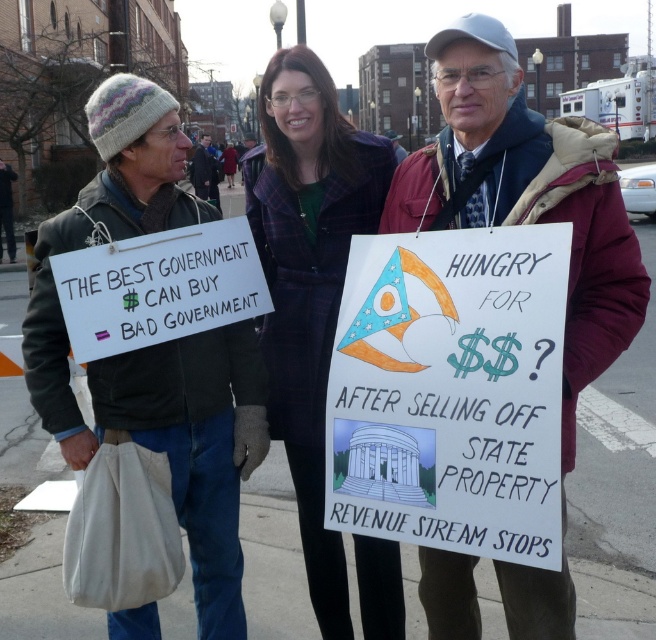
Does white paper sign at center have a larger size compared to plaid wool coat at center?

Actually, white paper sign at center might be smaller than plaid wool coat at center.

Who is more distant from viewer, (380, 529) or (350, 150)?

Point (350, 150)

Which is behind, point (543, 240) or point (277, 285)?

The point (277, 285) is more distant.

Identify the location of white paper sign at center. Image resolution: width=656 pixels, height=640 pixels. (451, 392).

Is maroon woolen jacket at center closer to camera compared to white paper sign at left?

Yes, it is in front of white paper sign at left.

Which of these two, maroon woolen jacket at center or white paper sign at left, stands shorter?

white paper sign at left

The height and width of the screenshot is (640, 656). What are the coordinates of `maroon woolen jacket at center` in the screenshot? It's located at (525, 195).

The width and height of the screenshot is (656, 640). What are the coordinates of `maroon woolen jacket at center` in the screenshot? It's located at (525, 195).

From the picture: Which is above, plaid wool coat at center or dark blue jacket at center?

dark blue jacket at center is above.

Can you confirm if plaid wool coat at center is shorter than dark blue jacket at center?

Yes.

Which is behind, point (333, 637) or point (203, 141)?

Positioned behind is point (203, 141).

The width and height of the screenshot is (656, 640). In order to click on plaid wool coat at center in this screenshot , I will do `click(308, 280)`.